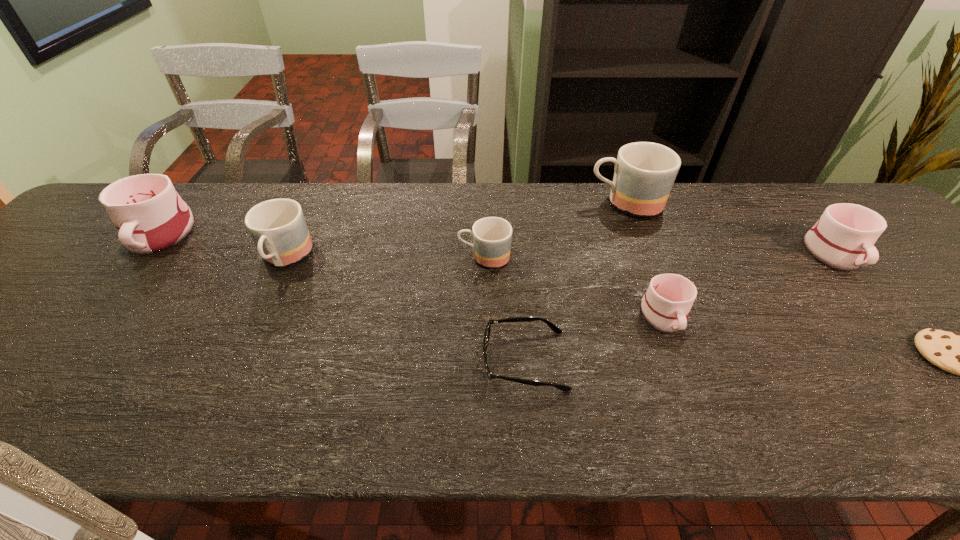
I want to click on the rightmost blue mug, so click(x=645, y=172).

Where is `the farthest blue mug`? This screenshot has width=960, height=540. the farthest blue mug is located at coordinates (645, 172).

Locate an element on the screen. The image size is (960, 540). the leftmost object is located at coordinates (150, 216).

Find the location of `the leftmost mug`. the leftmost mug is located at coordinates (150, 216).

This screenshot has height=540, width=960. What are the coordinates of `the second object from left to right` in the screenshot? It's located at (278, 228).

Identify the location of the leftmost blue mug. This screenshot has height=540, width=960. (278, 228).

Identify the location of the rightmost white mug. (843, 238).

Find the location of a particular element. The width and height of the screenshot is (960, 540). the second smallest white mug is located at coordinates (843, 238).

Find the location of a particular element. This screenshot has width=960, height=540. the smallest blue mug is located at coordinates (492, 236).

Find the location of a particular element. The image size is (960, 540). the third mug from left to right is located at coordinates (492, 236).